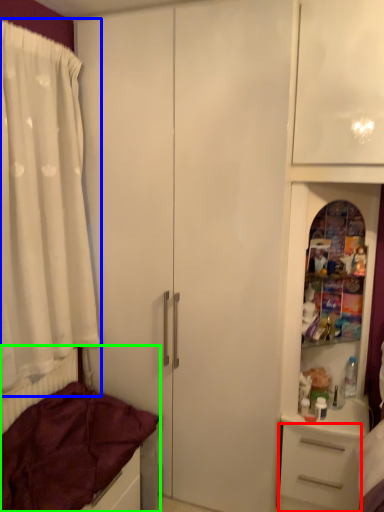
Question: Which object is the farthest from drawer (highlighted by a red box)? Choose among these: curtain (highlighted by a blue box) or bed (highlighted by a green box).

Choices:
 (A) curtain
 (B) bed

Answer: (A)